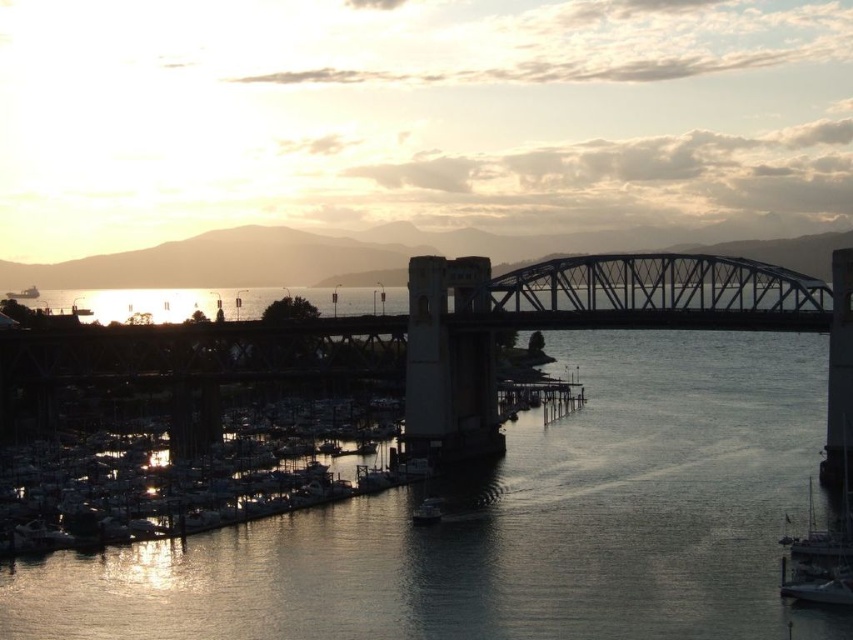
You are a photographer planning to capture the sunset reflection on the water. You have two boats in view, the white matte boats at lower left and the metallic gray boat at left. Which boat should you focus on if you want to highlight the reflection of the sunset in your photo?

The white matte boats at lower left are larger in size than the metallic gray boat at left, so focusing on the white matte boats at lower left would allow for a more prominent reflection of the sunset in the photo.

You are standing at the edge of the waterfront scene and want to walk from the dark gray concrete waterway at center to the white matte boats at lower left. Which direction should you head?

You should head downward towards the white matte boats at lower left because the dark gray concrete waterway at center is located above them.